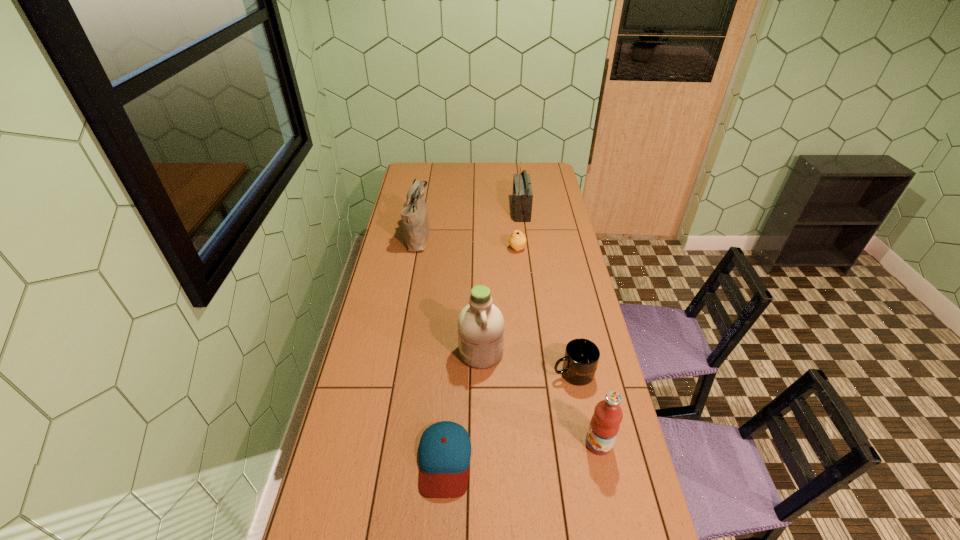
This screenshot has height=540, width=960. I want to click on vacant point located between the baseball cap and the cleansing agent, so click(463, 406).

Image resolution: width=960 pixels, height=540 pixels. Find the location of `vacant space that is in between the cleansing agent and the mug`. vacant space that is in between the cleansing agent and the mug is located at coordinates click(x=527, y=363).

At what (x,y) coordinates should I click in order to perform the action: click on vacant area that lies between the baseball cap and the shoulder bag. Please return your answer as a coordinate pair (x, y). The image size is (960, 540). Looking at the image, I should click on (432, 348).

Identify the location of vacant space in between the cleansing agent and the leftmost object. (450, 294).

Image resolution: width=960 pixels, height=540 pixels. What are the coordinates of `free space between the shoulder bag and the cleansing agent` in the screenshot? It's located at (450, 294).

The height and width of the screenshot is (540, 960). What are the coordinates of `empty location between the pear and the cleansing agent` in the screenshot? It's located at (499, 301).

The height and width of the screenshot is (540, 960). What are the coordinates of `free space between the cleansing agent and the pear` in the screenshot? It's located at (499, 301).

I want to click on object that ranks as the sixth closest to the pear, so click(x=605, y=423).

Point out which object is positioned as the third nearest to the radio receiver. Please provide its 2D coordinates. Your answer should be formatted as a tuple, i.e. [(x, y)], where the tuple contains the x and y coordinates of a point satisfying the conditions above.

[(480, 324)]

Identify the location of free space that satisfies the following two spatial constraints: 1. on the front-facing side of the pear; 2. on the right side of the shoulder bag. (417, 249).